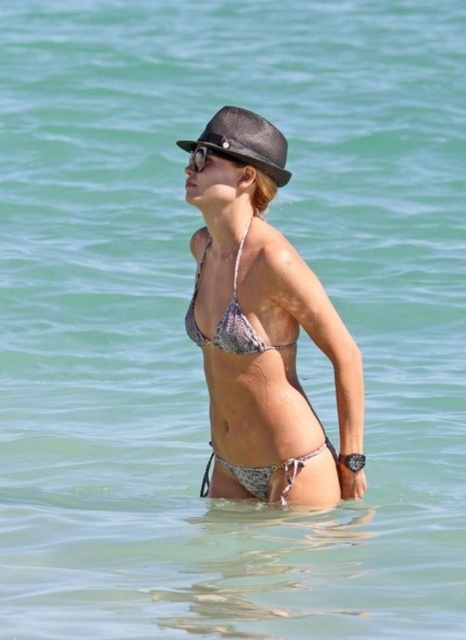
You are a fashion designer analyzing a beach scene. You notice the printed bikini at center and the black textured sunglasses at upper center. Which object is wider?

The printed bikini at center is wider than the black textured sunglasses at upper center.

You are a fashion designer observing the beach scene. You notice the printed bikini at center and the printed fabric bikini top at center. How far apart are these two items in inches?

The printed bikini at center is 8.66 inches from the printed fabric bikini top at center.

You are a photographer taking a picture of the scene described. You notice two points in the image at coordinates point (237, 259) and point (226, 152). Which point is closer to your camera lens?

Point (237, 259) is further to the viewer than point (226, 152), so the point closer to the camera lens is point (226, 152).